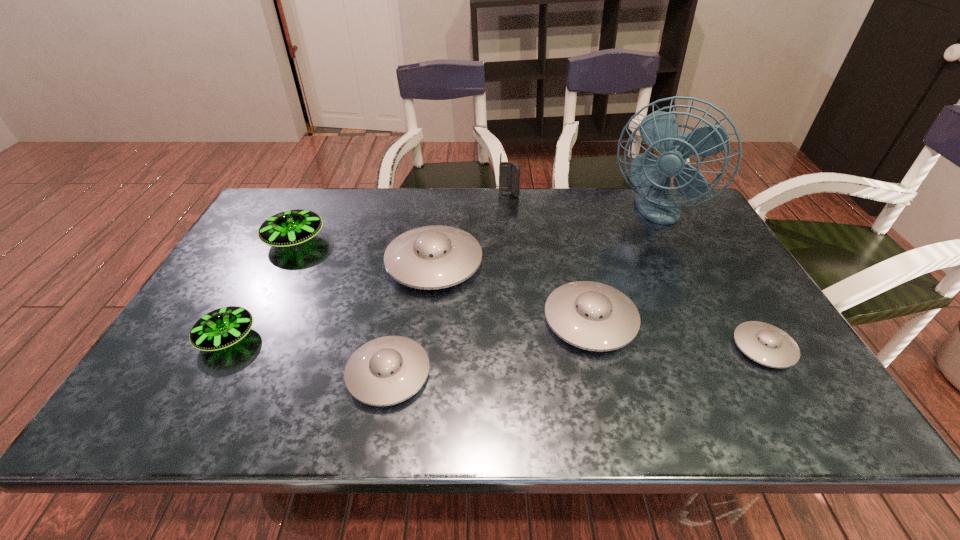
What are the coordinates of `the rightmost gray saucer` in the screenshot? It's located at 768,345.

Where is `vacant space located in front of the tallest object to blow air`? The image size is (960, 540). vacant space located in front of the tallest object to blow air is located at coordinates (718, 342).

The width and height of the screenshot is (960, 540). Find the location of `vacant space located 0.190m on the keyboard of the fifth object from left to right`. vacant space located 0.190m on the keyboard of the fifth object from left to right is located at coordinates (512, 232).

In order to click on vacant space located 0.290m on the front of the farther green saucer in this screenshot , I will do `click(245, 338)`.

This screenshot has width=960, height=540. In order to click on vacant area situated on the back of the biggest gray saucer in this screenshot , I will do [442, 202].

The image size is (960, 540). In order to click on vacant space situated 0.250m on the right of the second biggest gray saucer in this screenshot , I will do `click(738, 320)`.

Locate an element on the screen. This screenshot has height=540, width=960. free space located 0.280m on the right of the nearer green saucer is located at coordinates (375, 338).

Find the location of a particular element. The width and height of the screenshot is (960, 540). vacant space located on the left of the third biggest gray saucer is located at coordinates (228, 374).

Find the location of a particular element. The height and width of the screenshot is (540, 960). vacant space located 0.250m on the left of the rightmost saucer is located at coordinates click(x=626, y=348).

This screenshot has height=540, width=960. Identify the location of fan present at the far edge. (659, 130).